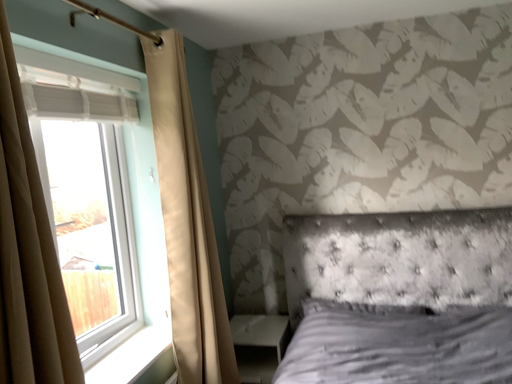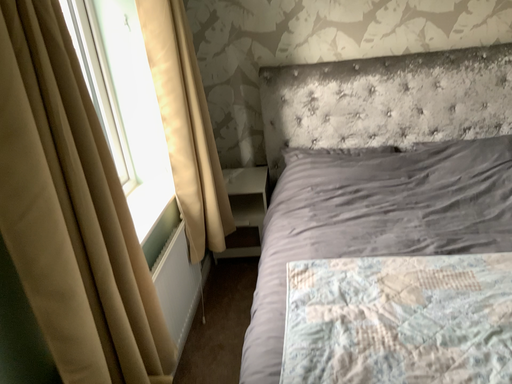
Question: How did the camera likely rotate when shooting the video?

Choices:
 (A) rotated downward
 (B) rotated upward

Answer: (A)